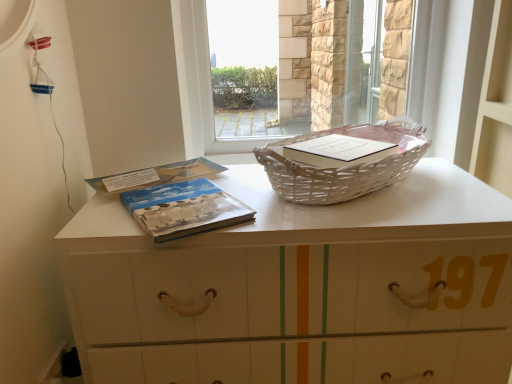
Find the location of a particular element. free space below blue matte book at center, the second paperback book when ordered from front to back (from a real-world perspective) is located at coordinates (180, 168).